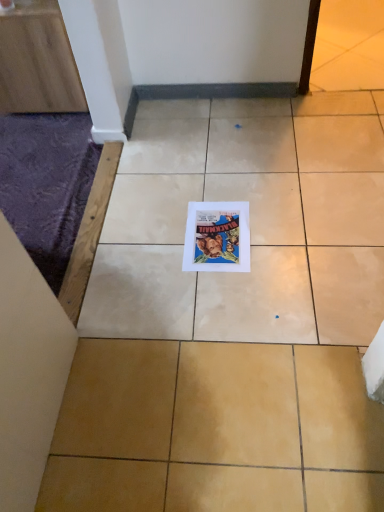
Identify the location of free space above matte paper comic book at center (from a real-world perspective). (219, 234).